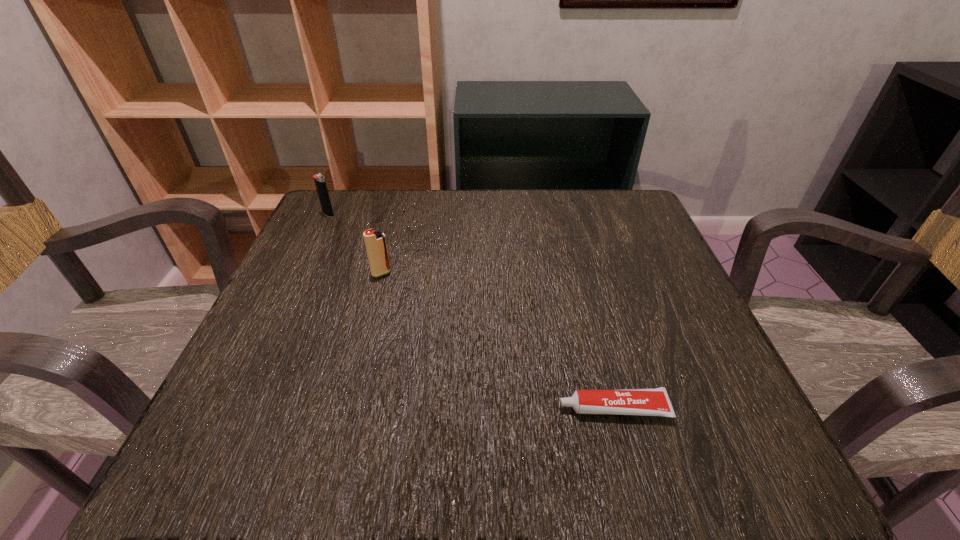
Locate an element on the screen. the second object from right to left is located at coordinates (375, 242).

The image size is (960, 540). I want to click on the second farthest object, so click(375, 242).

I want to click on the farthest object, so click(x=320, y=183).

This screenshot has width=960, height=540. Find the location of `the leftmost object`. the leftmost object is located at coordinates (320, 183).

Locate an element on the screen. This screenshot has height=540, width=960. toothpaste is located at coordinates (647, 402).

Find the location of a particular element. The width and height of the screenshot is (960, 540). the nearest object is located at coordinates (647, 402).

Locate an element on the screen. blank space located 0.250m on the right of the right igniter is located at coordinates (513, 273).

Where is `free region located on the right of the left igniter`? free region located on the right of the left igniter is located at coordinates (464, 214).

Where is `vacant space located at the nozzle of the shortest object`? This screenshot has height=540, width=960. vacant space located at the nozzle of the shortest object is located at coordinates (347, 408).

Identify the location of free space located at the nozzle of the shortest object. This screenshot has width=960, height=540. (413, 408).